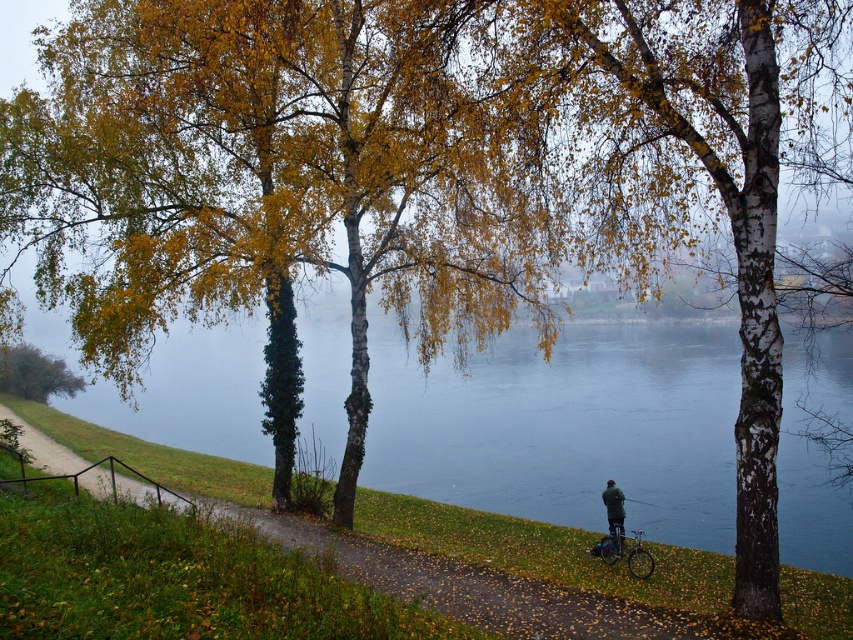
Question: Is blue water at center positioned at the back of silver metallic bicycle at lower right?

Choices:
 (A) yes
 (B) no

Answer: (B)

Question: Which point is farther to the camera?

Choices:
 (A) green matte tree at lower left
 (B) blue water at center
 (C) silver metallic bicycle at lower right

Answer: (A)

Question: Which object is closer to the camera taking this photo?

Choices:
 (A) green matte tree at lower left
 (B) silver metallic bicycle at lower right

Answer: (B)

Question: Is golden birch trees at center below dark green fabric jacket at lower right?

Choices:
 (A) yes
 (B) no

Answer: (B)

Question: Estimate the real-world distances between objects in this image. Which object is farther from the blue water at center?

Choices:
 (A) dark green fabric jacket at lower right
 (B) golden birch trees at center
 (C) silver metallic bicycle at lower right
 (D) green matte tree at lower left

Answer: (D)

Question: Observing the image, what is the correct spatial positioning of golden birch trees at center in reference to dark green jacket at lower right?

Choices:
 (A) left
 (B) right

Answer: (A)